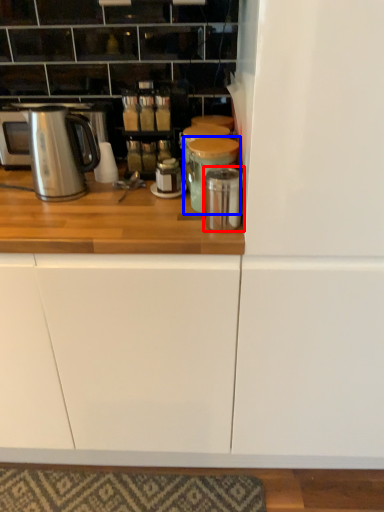
Question: Which object is closer to the camera taking this photo, appliance (highlighted by a red box) or appliance (highlighted by a blue box)?

Choices:
 (A) appliance
 (B) appliance

Answer: (A)